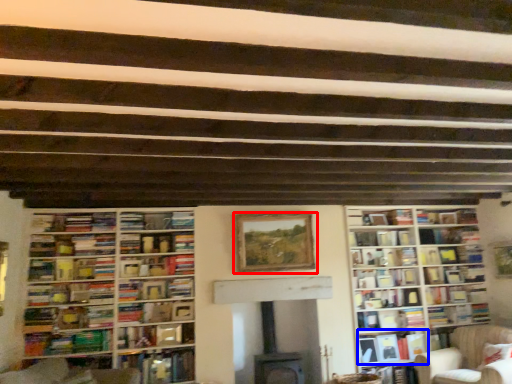
Question: Which object appears farthest to the camera in this image, picture frame (highlighted by a red box) or book (highlighted by a blue box)?

Choices:
 (A) picture frame
 (B) book

Answer: (B)